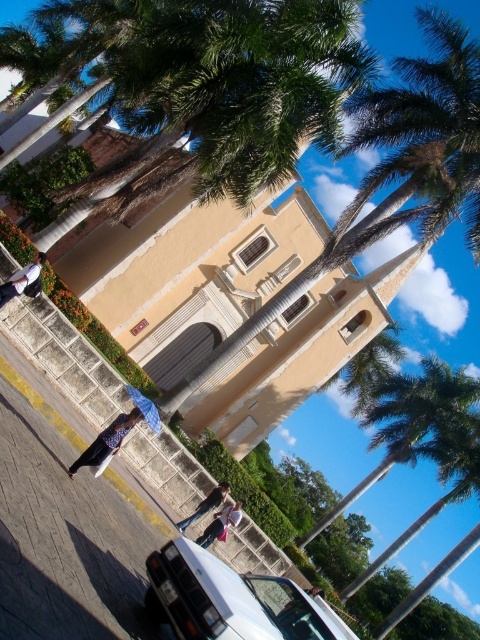
Question: Is leather jacket at lower left bigger than denim jacket at lower center?

Choices:
 (A) no
 (B) yes

Answer: (B)

Question: Among these objects, which one is nearest to the camera?

Choices:
 (A) white glossy car at lower left
 (B) leather jacket at lower left
 (C) denim jacket at lower center

Answer: (A)

Question: Which object is closer to the camera taking this photo?

Choices:
 (A) denim jacket at lower center
 (B) dark blue jeans at lower center

Answer: (A)

Question: Which is farther from the denim jacket at lower center?

Choices:
 (A) leather jacket at lower left
 (B) white glossy car at lower left

Answer: (B)

Question: Does denim jacket at lower left lie behind dark blue jeans at lower center?

Choices:
 (A) yes
 (B) no

Answer: (B)

Question: Can you confirm if denim jacket at lower center is positioned to the right of dark blue jeans at lower center?

Choices:
 (A) no
 (B) yes

Answer: (B)